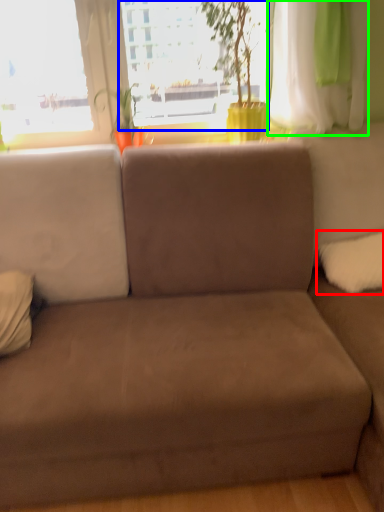
Question: Estimate the real-world distances between objects in this image. Which object is farther from pillow (highlighted by a red box), window screen (highlighted by a blue box) or curtain (highlighted by a green box)?

Choices:
 (A) window screen
 (B) curtain

Answer: (A)